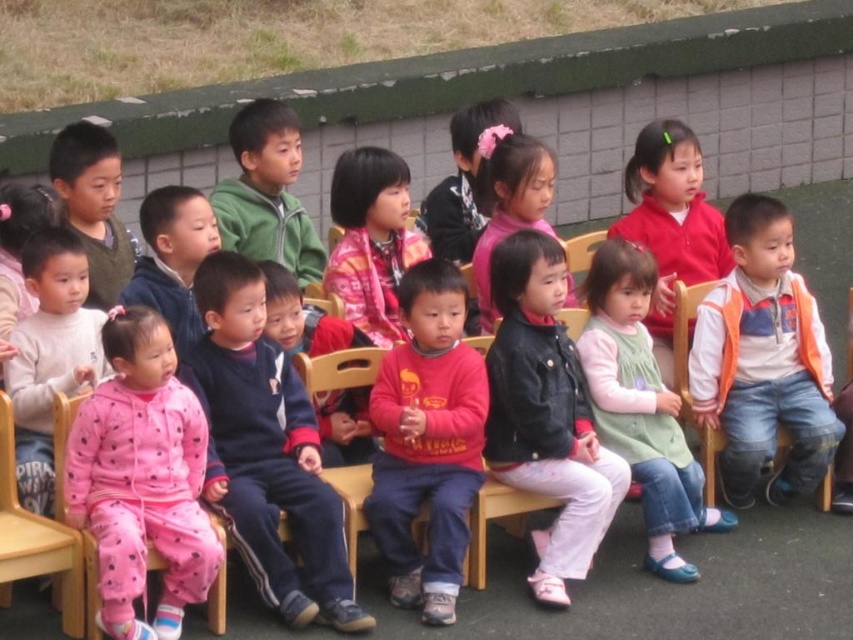
You are a photographer trying to capture a photo of the children in the scene. You need to ensure that both the pink fleece pajamas at lower left and the orange fleece vest at right are clearly visible in the frame. Given their heights, which child should you focus on first to ensure they are in focus?

The pink fleece pajamas at lower left is shorter than the orange fleece vest at right, so you should focus on the orange fleece vest at right first to ensure both are in focus.

You are a photographer setting up for a group photo. You notice a green dress at center and a wooden chair at lower left in the scene. Which object takes up more space in the image?

The green dress at center is larger in size than the wooden chair at lower left, so it takes up more space in the image.